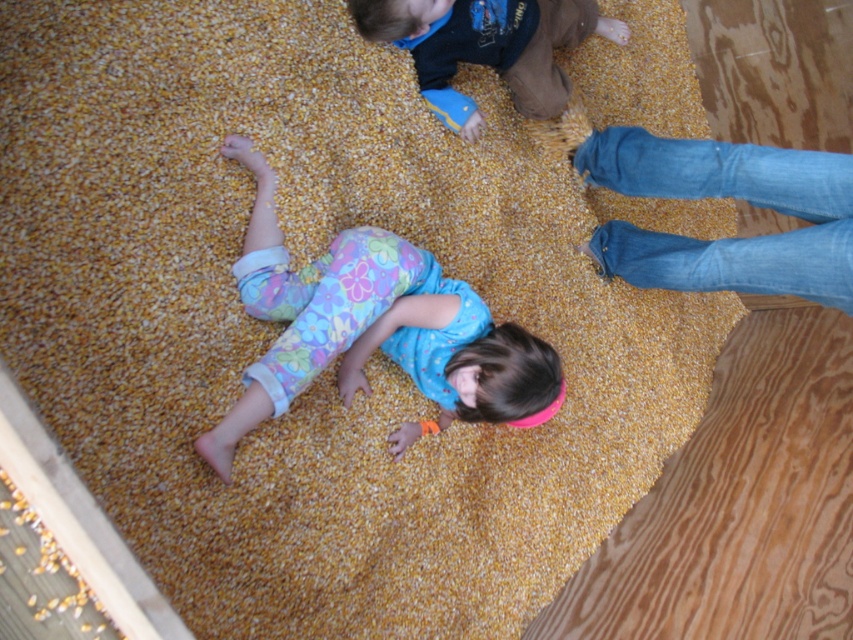
Is floral fabric toddler at center taller than dark blue shirt at upper center?

Yes, floral fabric toddler at center is taller than dark blue shirt at upper center.

Which is more to the left, floral fabric toddler at center or dark blue shirt at upper center?

floral fabric toddler at center

Locate an element on the screen. floral fabric toddler at center is located at coordinates (372, 330).